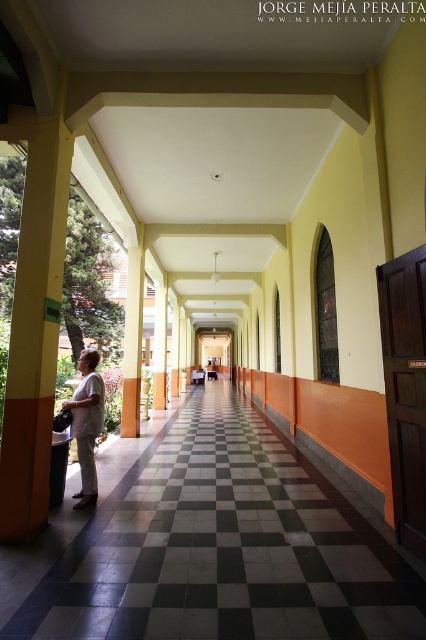
You are standing at the entrance of the corridor and see the white matte shirt at center and the orange matte pillar at center. Which object is closer to you?

The white matte shirt at center is closer to you because it is in front of the orange matte pillar at center.

You are standing at point (164, 342) in the corridor and want to walk to the open area ahead. Is the point (80, 508) in your path?

Yes, point (80, 508) is in front of point (164, 342), so it is in your path.

Consider the image. You are standing at the entrance of the corridor and see the orange painted pillar at center and the orange matte pillar at center. Which pillar is positioned to the right of the other?

The orange painted pillar at center is to the right of the orange matte pillar at center.